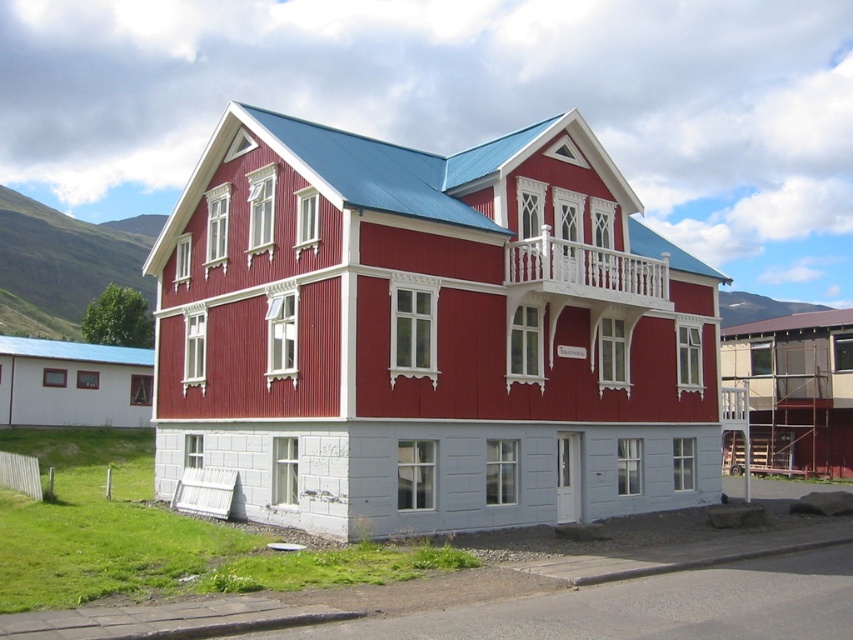
You are standing in front of the two story building and want to locate the white wooden balcony at center and the white wooden balcony at upper center. Based on their positions, which one is positioned to the left of the other?

The white wooden balcony at center is to the left of white wooden balcony at upper center.

You are an architect designing a new building and want to ensure proper spacing between the white wooden balcony at center and the white wooden balcony at upper center. Given that the smaller balcony is above the larger one, which balcony should be placed higher to maintain structural balance?

The white wooden balcony at upper center should be placed higher since it is smaller and positioned above the larger white wooden balcony at center, maintaining structural balance by aligning size with elevation.